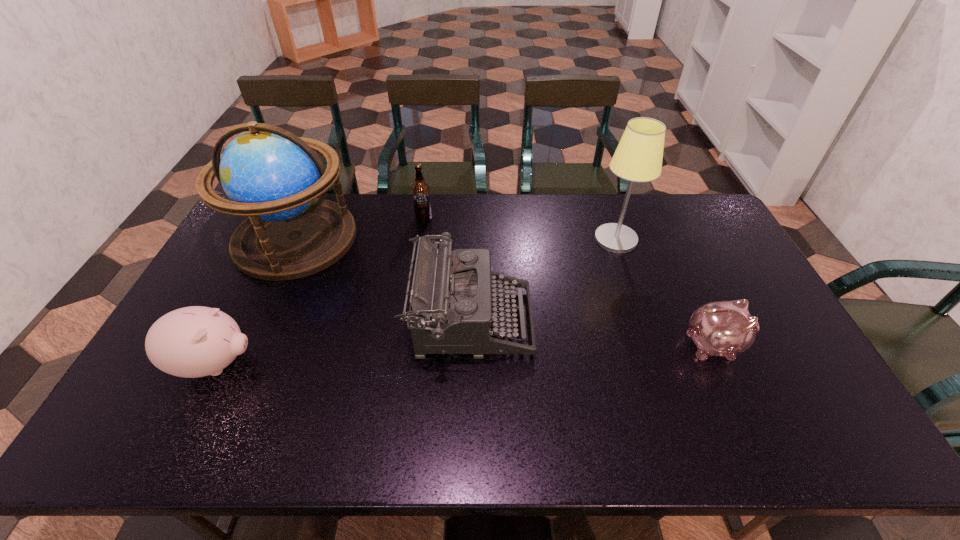
The height and width of the screenshot is (540, 960). I want to click on free space that satisfies the following two spatial constraints: 1. on the label of the beer bottle; 2. on the left side of the second object from right to left, so click(x=420, y=239).

Where is `free space in the image that satisfies the following two spatial constraints: 1. on the front side of the fifth object from left to right; 2. on the front facing side of the shorter piggy bank`? The height and width of the screenshot is (540, 960). free space in the image that satisfies the following two spatial constraints: 1. on the front side of the fifth object from left to right; 2. on the front facing side of the shorter piggy bank is located at coordinates (652, 345).